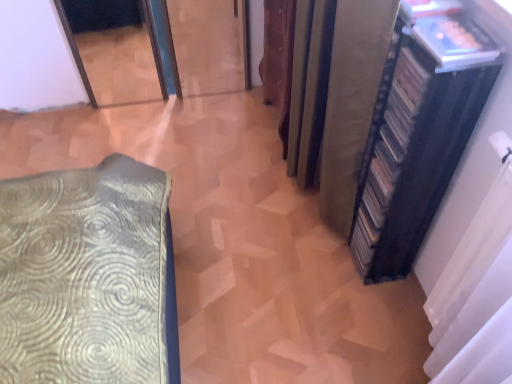
Find the location of a particular element. Image resolution: width=512 pixels, height=384 pixels. vacant region below silky beige curtain at right, marked as the first curtain in a left-to-right arrangement (from a real-world perspective) is located at coordinates (307, 201).